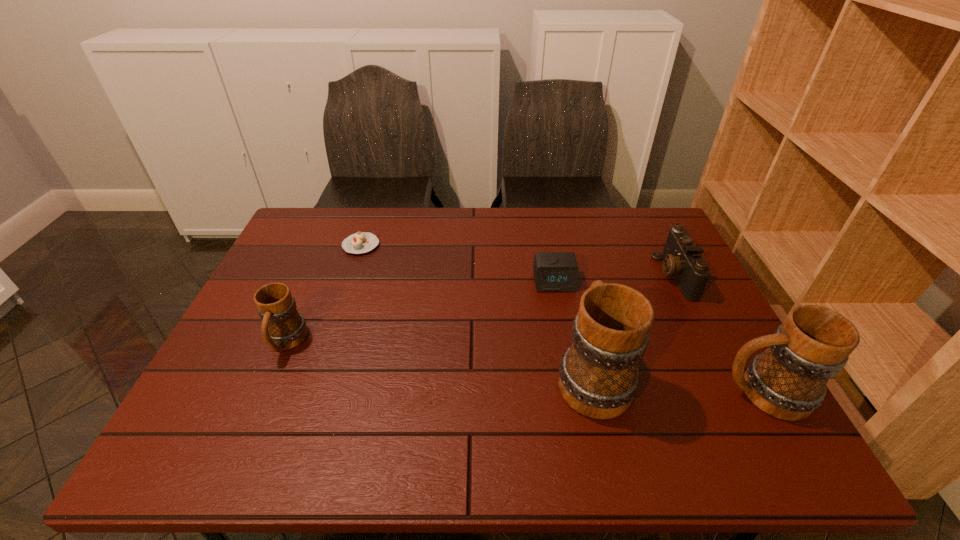
Identify the location of mug that is the closest one to the second mug from right to left. This screenshot has height=540, width=960. (787, 381).

The image size is (960, 540). I want to click on mug that is the second closest to the alarm clock, so click(x=787, y=381).